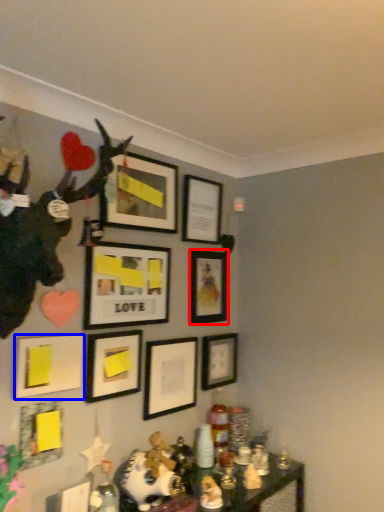
Question: Which object appears closest to the camera in this image, picture frame (highlighted by a red box) or picture frame (highlighted by a blue box)?

Choices:
 (A) picture frame
 (B) picture frame

Answer: (B)